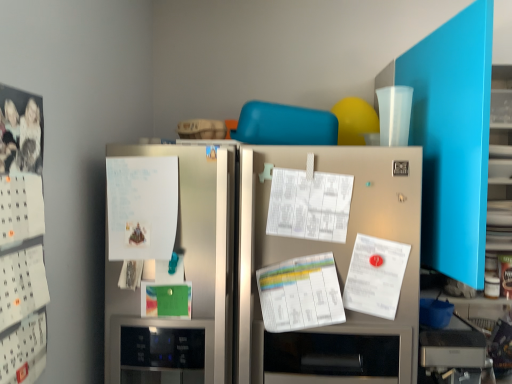
Question: Can you confirm if white paper at left is bigger than white paper calendar at left?

Choices:
 (A) no
 (B) yes

Answer: (A)

Question: From a real-world perspective, is white paper at left beneath white paper calendar at left?

Choices:
 (A) no
 (B) yes

Answer: (A)

Question: Considering the relative sizes of white paper at left and white paper calendar at left in the image provided, is white paper at left smaller than white paper calendar at left?

Choices:
 (A) yes
 (B) no

Answer: (A)

Question: From a real-world perspective, does white paper at left stand above white paper calendar at left?

Choices:
 (A) no
 (B) yes

Answer: (B)

Question: From the image's perspective, does white paper at left appear lower than white paper calendar at left?

Choices:
 (A) no
 (B) yes

Answer: (A)

Question: In terms of width, does white paper at left look wider or thinner when compared to white paper calendar at left?

Choices:
 (A) thin
 (B) wide

Answer: (B)

Question: In terms of height, does white paper at left look taller or shorter compared to white paper calendar at left?

Choices:
 (A) short
 (B) tall

Answer: (A)

Question: From the image's perspective, is white paper at left located above or below white paper calendar at left?

Choices:
 (A) below
 (B) above

Answer: (B)

Question: Is white paper at left spatially inside white paper calendar at left, or outside of it?

Choices:
 (A) outside
 (B) inside

Answer: (A)

Question: Considering the positions of white paper at left and satin silver refrigerator at center in the image, is white paper at left wider or thinner than satin silver refrigerator at center?

Choices:
 (A) wide
 (B) thin

Answer: (B)

Question: From the image's perspective, is white paper at left located above or below satin silver refrigerator at center?

Choices:
 (A) below
 (B) above

Answer: (B)

Question: Based on their positions, is white paper at left located to the left or right of satin silver refrigerator at center?

Choices:
 (A) right
 (B) left

Answer: (B)

Question: Which is correct: white paper at left is inside satin silver refrigerator at center, or outside of it?

Choices:
 (A) inside
 (B) outside

Answer: (A)

Question: Is point (294, 337) positioned closer to the camera than point (5, 327)?

Choices:
 (A) farther
 (B) closer

Answer: (A)

Question: Is satin silver refrigerator at center to the left or to the right of white paper calendar at left in the image?

Choices:
 (A) right
 (B) left

Answer: (A)